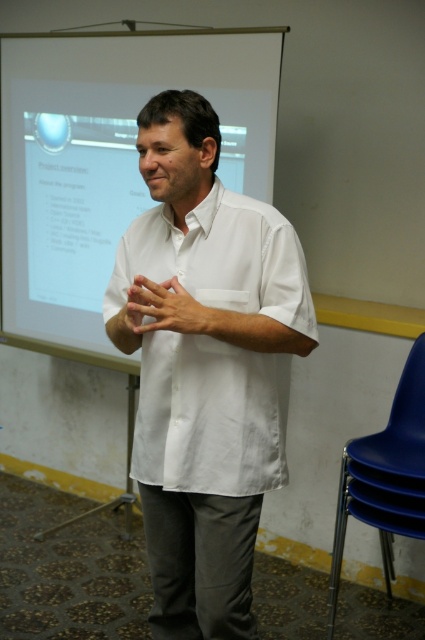
Question: Is white matte shirt at center thinner than blue plastic chair at lower right?

Choices:
 (A) no
 (B) yes

Answer: (A)

Question: Estimate the real-world distances between objects in this image. Which object is farther from the matte white hand at center?

Choices:
 (A) white glossy projector screen at upper center
 (B) white matte shirt at center
 (C) blue plastic chair at lower right

Answer: (A)

Question: Is the position of white matte shirt at center less distant than that of matte white hand at center?

Choices:
 (A) yes
 (B) no

Answer: (B)

Question: Which point is closer to the camera?

Choices:
 (A) white glossy projector screen at upper center
 (B) matte white hand at center
 (C) white matte shirt at center

Answer: (B)

Question: In this image, where is white matte shirt at center located relative to blue plastic chair at lower right?

Choices:
 (A) below
 (B) above

Answer: (B)

Question: Which object appears closest to the camera in this image?

Choices:
 (A) white matte shirt at center
 (B) matte white hand at center
 (C) blue plastic chair at lower right

Answer: (B)